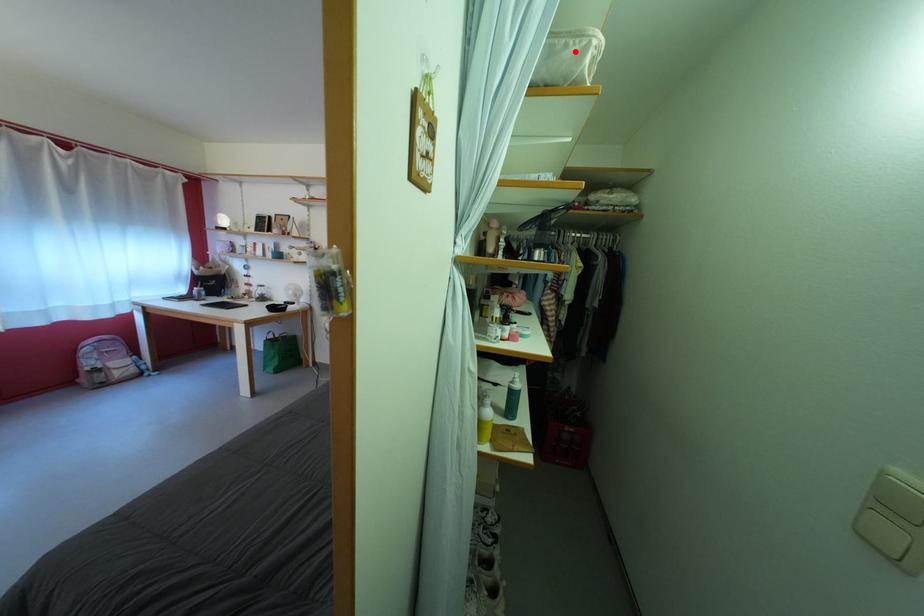
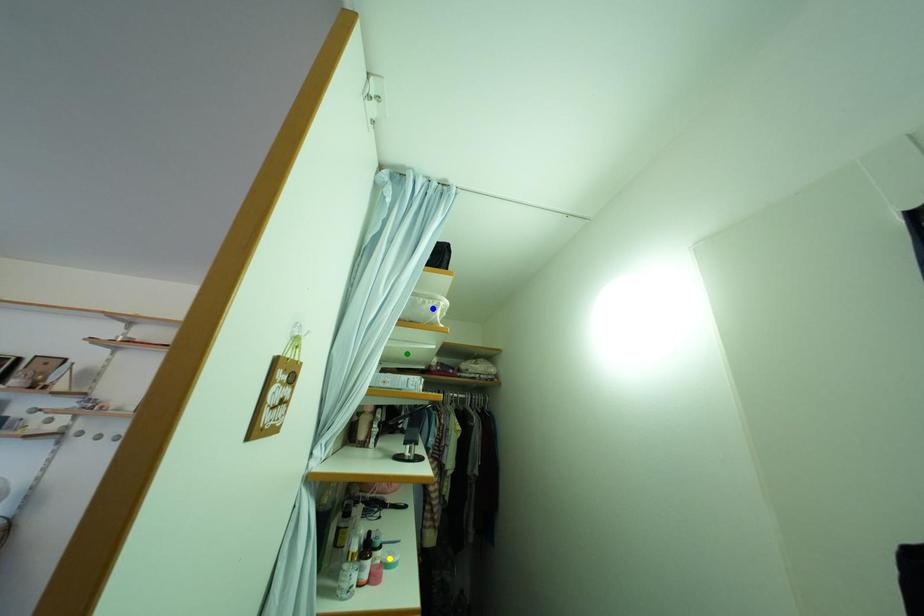
Question: I am providing you with two images of the same scene from different viewpoints. A red point is marked on the first image. You are given multiple points on the second image. In image 2, which mark is for the same physical point as the one in image 1?

Choices:
 (A) yellow point
 (B) blue point
 (C) green point

Answer: (B)